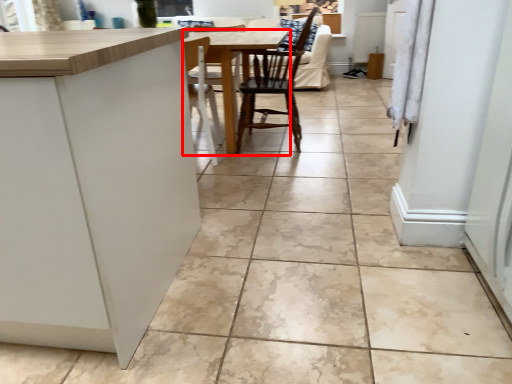
Question: From the image's perspective, where is table (annotated by the red box) located relative to chair?

Choices:
 (A) below
 (B) above

Answer: (A)